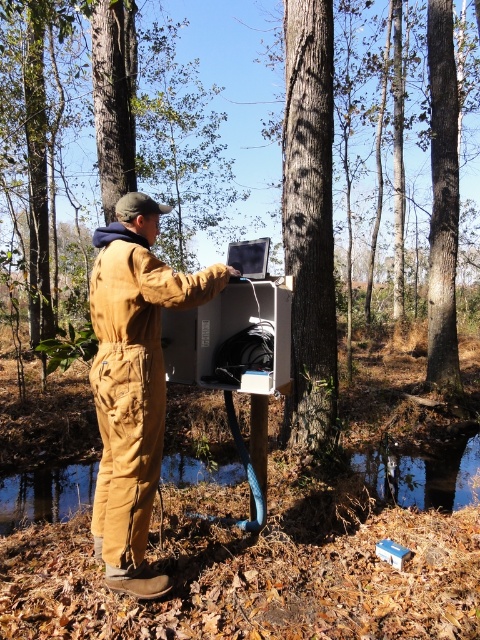
Question: Is brown cotton jumpsuit at center closer to the viewer compared to smooth bark tree at center?

Choices:
 (A) yes
 (B) no

Answer: (A)

Question: Among these objects, which one is farthest from the camera?

Choices:
 (A) smooth bark tree at center
 (B) brown cotton jumpsuit at center

Answer: (A)

Question: Which object appears closest to the camera in this image?

Choices:
 (A) smooth bark tree at center
 (B) brown cotton jumpsuit at center

Answer: (B)

Question: Considering the relative positions of brown cotton jumpsuit at center and smooth bark tree at center in the image provided, where is brown cotton jumpsuit at center located with respect to smooth bark tree at center?

Choices:
 (A) below
 (B) above

Answer: (A)

Question: Which of the following is the closest to the observer?

Choices:
 (A) brown cotton jumpsuit at center
 (B) smooth bark tree at center

Answer: (A)

Question: Does brown cotton jumpsuit at center have a larger size compared to smooth bark tree at center?

Choices:
 (A) no
 (B) yes

Answer: (A)